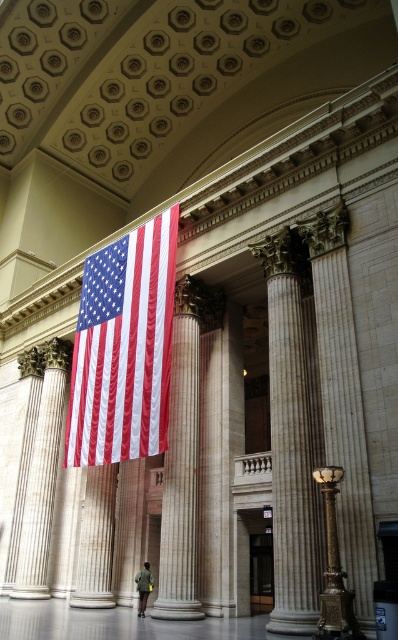
Question: Estimate the real-world distances between objects in this image. Which object is farther from the beige marble column at center?

Choices:
 (A) dark green fabric jacket at center
 (B) matte fabric flag at center

Answer: (A)

Question: Which point is farther to the camera?

Choices:
 (A) (165, 416)
 (B) (146, 579)
 (C) (193, 557)

Answer: (B)

Question: Does matte fabric flag at center lie in front of beige marble column at center?

Choices:
 (A) yes
 (B) no

Answer: (B)

Question: Does matte fabric flag at center come behind beige marble column at center?

Choices:
 (A) yes
 (B) no

Answer: (A)

Question: Does matte fabric flag at center have a lesser width compared to dark green fabric jacket at center?

Choices:
 (A) no
 (B) yes

Answer: (A)

Question: Which object appears farthest from the camera in this image?

Choices:
 (A) beige marble column at center
 (B) matte fabric flag at center
 (C) dark green fabric jacket at center

Answer: (C)